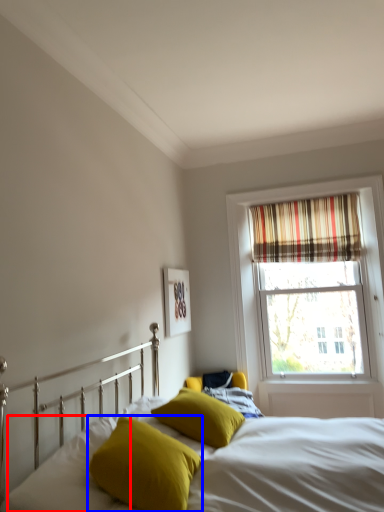
Question: Which point is closer to the camera, pillow (highlighted by a red box) or pillow (highlighted by a blue box)?

Choices:
 (A) pillow
 (B) pillow

Answer: (A)